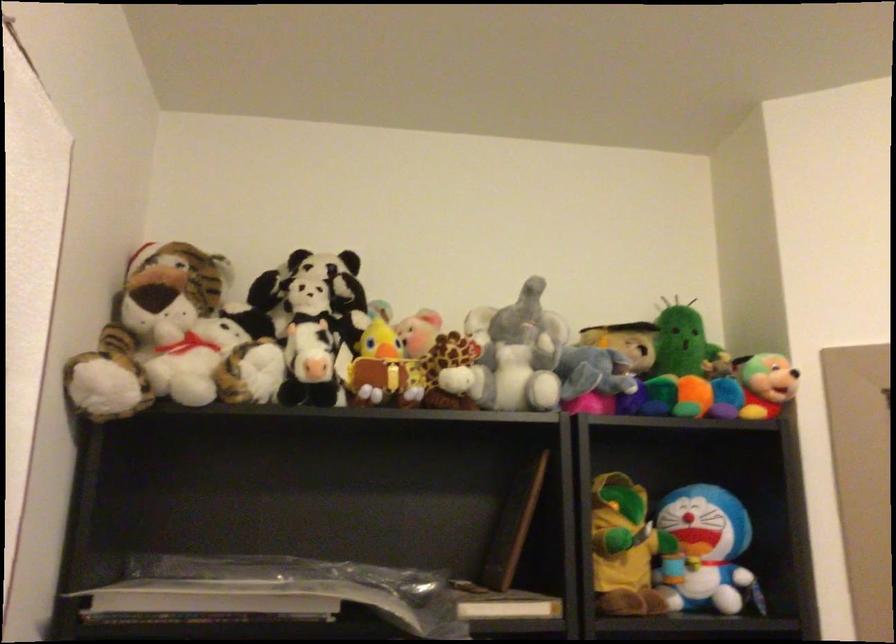
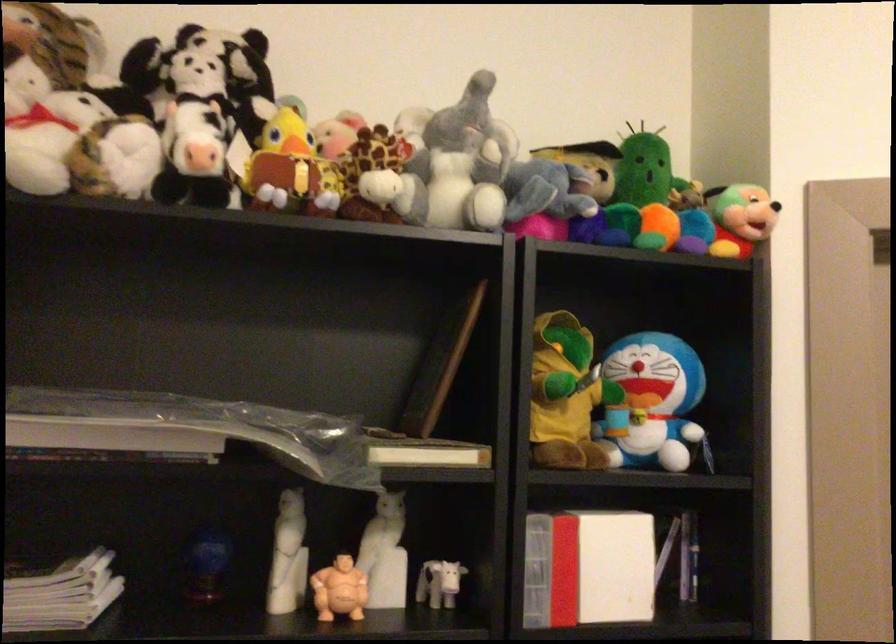
Question: The first image is from the beginning of the video and the second image is from the end. How did the camera likely rotate when shooting the video?

Choices:
 (A) Left
 (B) Right
 (C) Up
 (D) Down

Answer: (D)